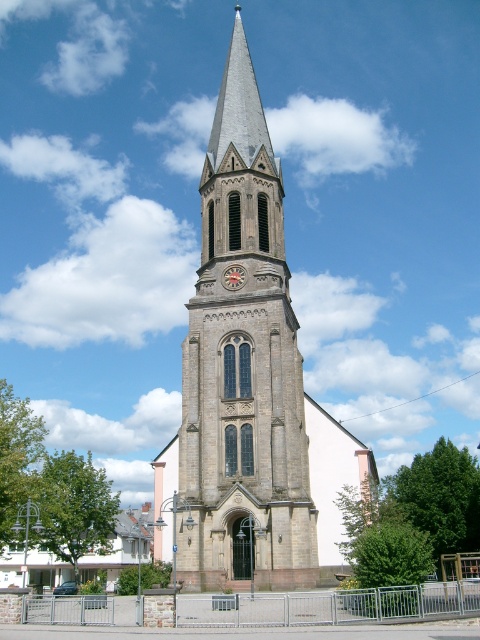
You are standing at the entrance of the brown stone clock tower at center. If you walk straight ahead, will you exit the building through the main entrance or enter a different part of the tower?

Since the brown stone clock tower at center is located at point (242, 365), walking straight ahead from the entrance would likely lead you into the interior of the tower, not back out through the main entrance. The coordinates suggest the entrance is positioned at the base of the tower, so moving forward would take you inside rather than exiting.

You are an architect designing a new park layout and need to place a bench between the brown stone clock tower at center and the red painted wooden clock at center. Given their widths, which object should the bench be closer to and why?

The bench should be closer to the red painted wooden clock at center because the brown stone clock tower at center is wider than the red painted wooden clock at center, so placing the bench closer to the narrower object allows for better spatial balance.